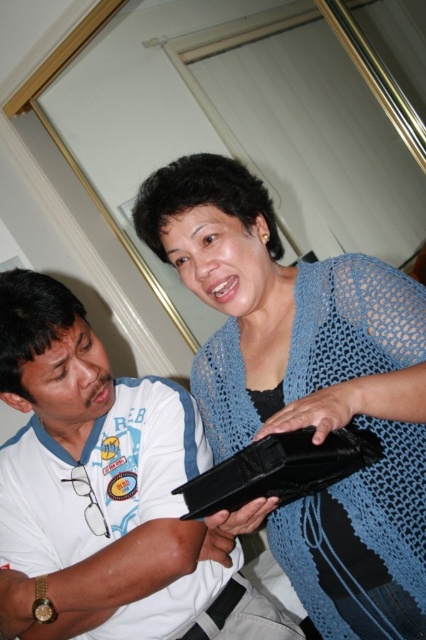
Question: Among these objects, which one is nearest to the camera?

Choices:
 (A) blue knitted sweater at center
 (B) white matte shirt at lower left

Answer: (A)

Question: Which of the following is the farthest from the observer?

Choices:
 (A) (57, 307)
 (B) (213, 380)

Answer: (B)

Question: Does blue knitted sweater at center appear on the right side of white matte shirt at lower left?

Choices:
 (A) no
 (B) yes

Answer: (B)

Question: Does blue knitted sweater at center have a greater width compared to white matte shirt at lower left?

Choices:
 (A) no
 (B) yes

Answer: (A)

Question: Can you confirm if blue knitted sweater at center is positioned to the right of white matte shirt at lower left?

Choices:
 (A) yes
 (B) no

Answer: (A)